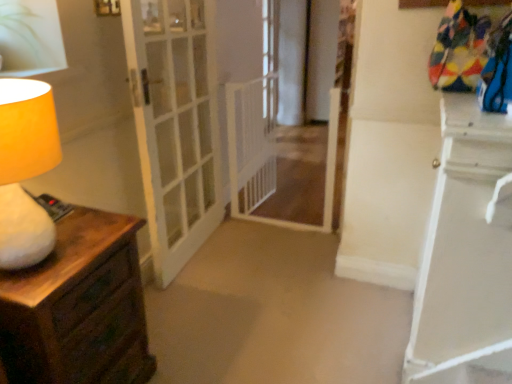
Question: Is clear glass window at center taller or shorter than wooden chest of drawers at left?

Choices:
 (A) short
 (B) tall

Answer: (B)

Question: From a real-world perspective, is clear glass window at center above or below wooden chest of drawers at left?

Choices:
 (A) above
 (B) below

Answer: (A)

Question: Based on their relative distances, which object is nearer to the clear glass window at center?

Choices:
 (A) white glossy nightstand at right
 (B) white glass door at center
 (C) green leafy plant at upper left
 (D) matte yellow lampshade at left
 (E) white mesh gate at center

Answer: (E)

Question: Based on their relative distances, which object is nearer to the white glass door at center?

Choices:
 (A) green leafy plant at upper left
 (B) matte yellow lampshade at left
 (C) wooden chest of drawers at left
 (D) white mesh gate at center
 (E) white glossy nightstand at right

Answer: (D)